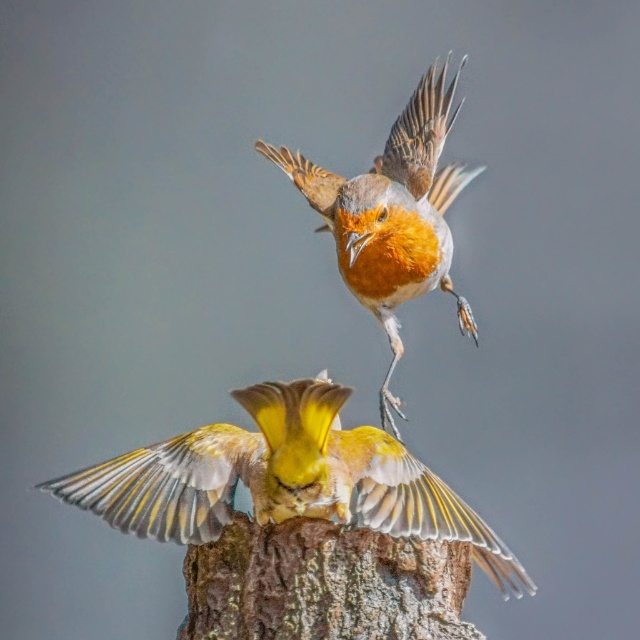
You are an ornithologist observing two birds in a gray background. You see the brown rough tree trunk at center and the bright orange feathers at center. Which object is shorter in height?

The brown rough tree trunk at center is not as tall as bright orange feathers at center, so the brown rough tree trunk at center is shorter in height.

In the scene shown: You are a birdwatcher observing the scene. You notice the brown rough tree trunk at center and the bright orange feathers at center. Which object is positioned to the right side of the other?

The brown rough tree trunk at center is to the left of bright orange feathers at center, so the bright orange feathers at center is positioned to the right of the brown rough tree trunk at center.

You are a birdwatcher trying to locate the yellow matte bird at center. Based on the coordinates provided, where should you focus your binoculars relative to the European Robin in the foreground?

The yellow matte bird at center is located at point 0.750 on the x axis and 0.445 on the y axis, which is below the European Robin in the foreground. So you should focus your binoculars below the European Robin to find the yellow matte bird at center.